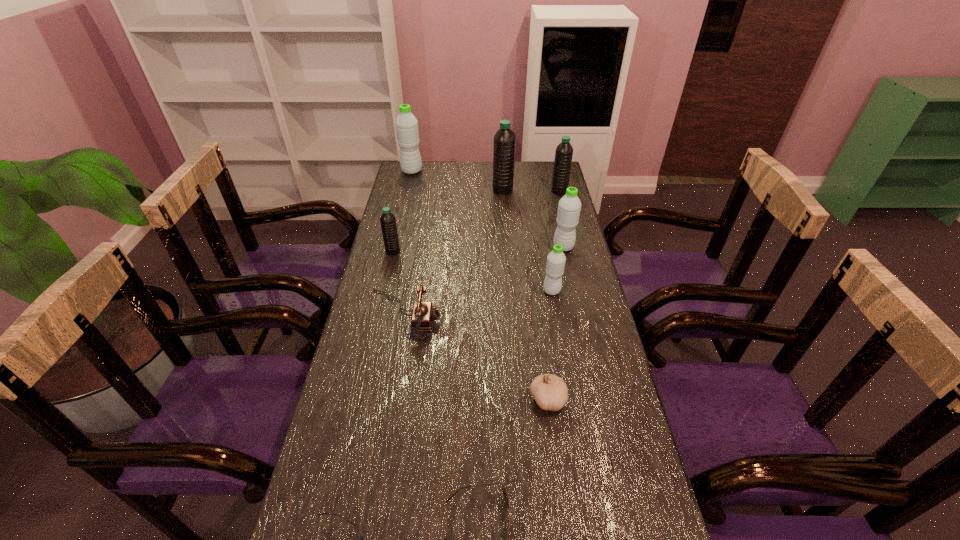
Where is `the second closest black water bottle relative to the nearest black water bottle`? Image resolution: width=960 pixels, height=540 pixels. the second closest black water bottle relative to the nearest black water bottle is located at coordinates (564, 151).

At what (x,y) coordinates should I click in order to perform the action: click on free space that satisfies the following two spatial constraints: 1. on the front side of the second smallest green water bottle; 2. on the dial of the telephone. Please return your answer as a coordinate pair (x, y). Looking at the image, I should click on (579, 315).

Find the location of `blank space that satisfies the following two spatial constraints: 1. on the back side of the second smallest black water bottle; 2. on the right side of the third shortest object`. blank space that satisfies the following two spatial constraints: 1. on the back side of the second smallest black water bottle; 2. on the right side of the third shortest object is located at coordinates (520, 191).

In order to click on blank space that satisfies the following two spatial constraints: 1. on the back side of the second green water bottle from left to right; 2. on the right side of the third nearest object in this screenshot , I will do `click(534, 291)`.